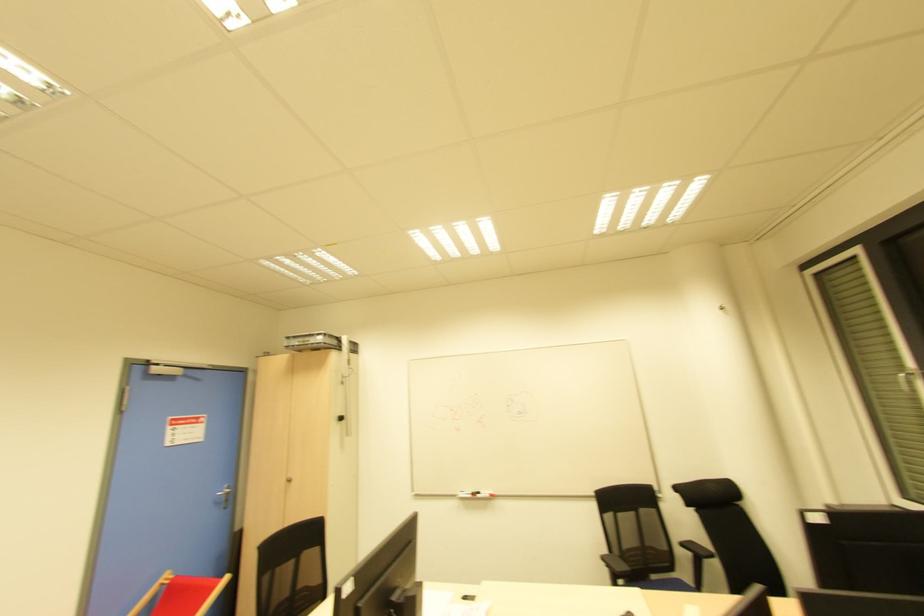
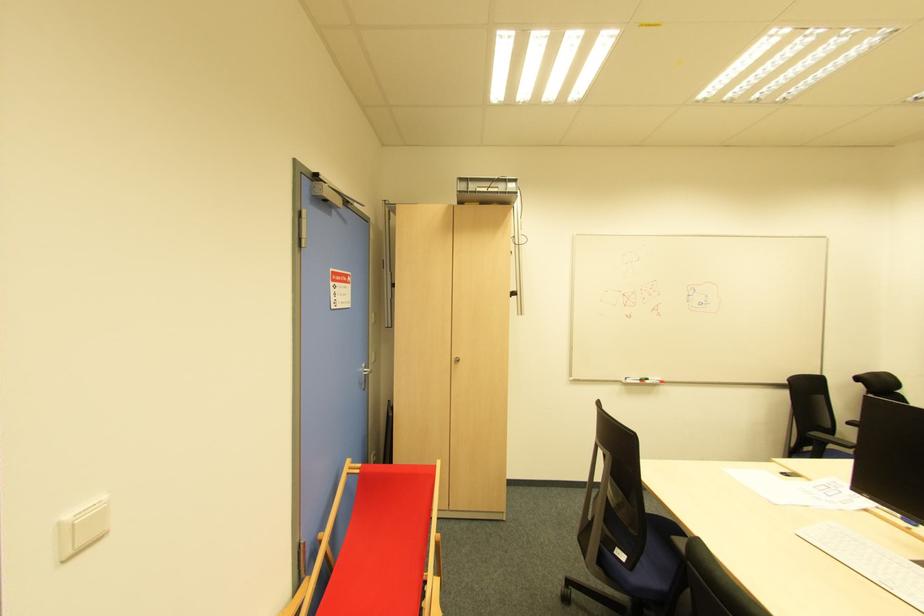
The point at (225, 501) is marked in the first image. Where is the corresponding point in the second image?

(366, 382)